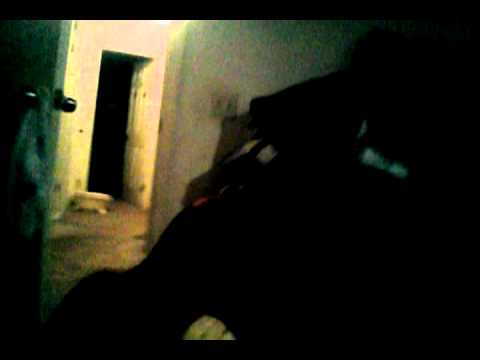
You are a GUI agent. You are given a task and a screenshot of the screen. Output one action in this format:
    pyautogui.click(x=<x>, y=<y>)
    Task: Click on the switch plate
    The width and height of the screenshot is (480, 360).
    Given the screenshot: What is the action you would take?
    pyautogui.click(x=222, y=114)